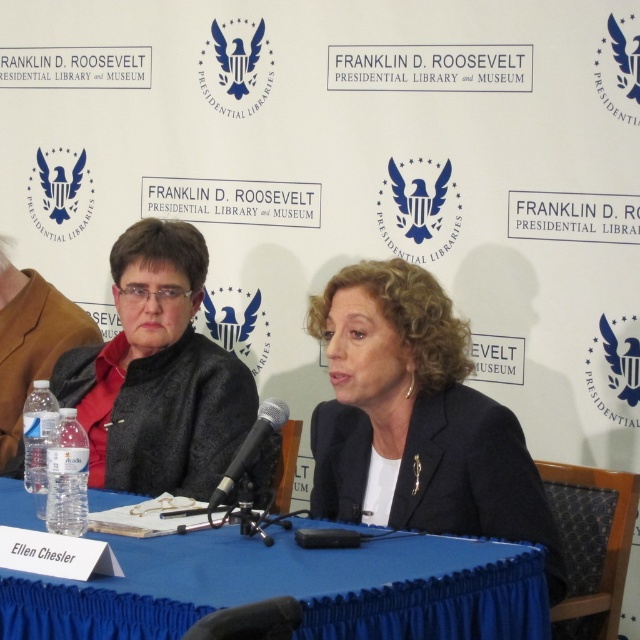
Is point (61, 388) positioned in front of point (269, 401)?

No, (61, 388) is behind (269, 401).

Is matte black jacket at left thinner than black metallic microphone at center?

No, matte black jacket at left is not thinner than black metallic microphone at center.

Between point (179, 435) and point (266, 401), which one is positioned in front?

Point (266, 401) is more forward.

Find the location of a particular element. Image resolution: width=640 pixels, height=640 pixels. matte black jacket at left is located at coordinates (157, 372).

Between dark blue suit at center and clear plastic water bottles at left, which one appears on the right side from the viewer's perspective?

From the viewer's perspective, dark blue suit at center appears more on the right side.

Find the location of a particular element. Image resolution: width=640 pixels, height=640 pixels. dark blue suit at center is located at coordinates pyautogui.click(x=417, y=419).

Measure the distance between dark blue suit at center and camera.

dark blue suit at center is 5.79 feet away from camera.

The height and width of the screenshot is (640, 640). Find the location of `dark blue suit at center`. dark blue suit at center is located at coordinates (417, 419).

Between blue fabric table at center and dark blue suit at center, which one has less height?

Standing shorter between the two is blue fabric table at center.

Is blue fabric table at center taller than dark blue suit at center?

No, blue fabric table at center is not taller than dark blue suit at center.

You are a GUI agent. You are given a task and a screenshot of the screen. Output one action in this format:
    pyautogui.click(x=<x>, y=<y>)
    Task: Click on the blue fabric table at center
    The height and width of the screenshot is (640, 640).
    Given the screenshot: What is the action you would take?
    pyautogui.click(x=291, y=588)

This screenshot has height=640, width=640. I want to click on blue fabric table at center, so click(x=291, y=588).